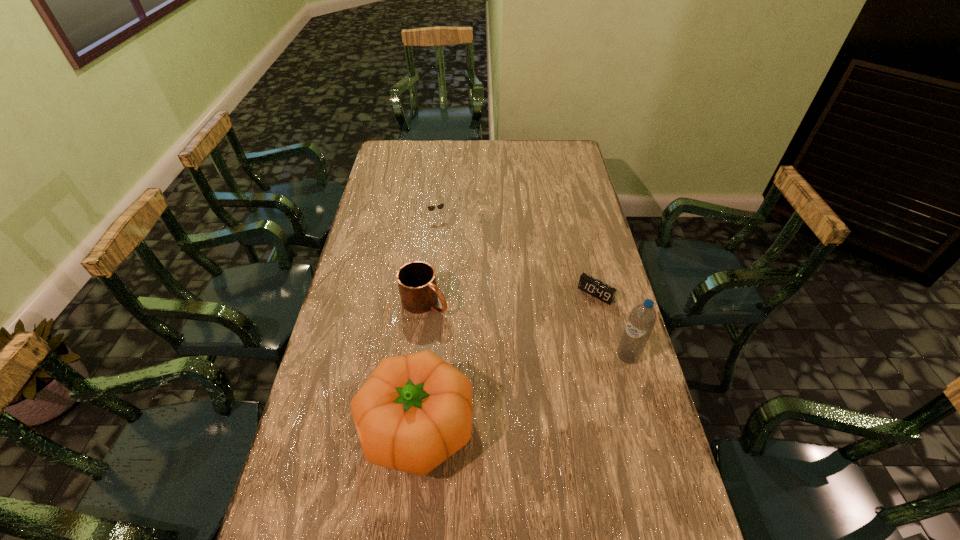
The image size is (960, 540). What are the coordinates of `the nearest object` in the screenshot? It's located at (414, 411).

Find the location of a particular element. This screenshot has height=540, width=960. the fourth farthest object is located at coordinates (642, 319).

Where is `alarm clock`? The height and width of the screenshot is (540, 960). alarm clock is located at coordinates (596, 288).

The height and width of the screenshot is (540, 960). What are the coordinates of `the third shortest object` in the screenshot? It's located at (419, 293).

Locate an element on the screen. The width and height of the screenshot is (960, 540). the fourth tallest object is located at coordinates (440, 206).

Where is `sunglasses`? sunglasses is located at coordinates (440, 206).

Where is `vacant area situated 0.110m on the carved face of the pumpkin`? The width and height of the screenshot is (960, 540). vacant area situated 0.110m on the carved face of the pumpkin is located at coordinates (316, 427).

Image resolution: width=960 pixels, height=540 pixels. Find the location of `free point located 0.100m on the carved face of the pumpkin`. free point located 0.100m on the carved face of the pumpkin is located at coordinates (320, 427).

This screenshot has height=540, width=960. I want to click on vacant space located on the carved face of the pumpkin, so click(307, 427).

You are a GUI agent. You are given a task and a screenshot of the screen. Output one action in this format:
    pyautogui.click(x=<x>, y=<y>)
    Task: Click on the vacant space situated 0.400m on the front of the second nearest object
    
    Given the screenshot: What is the action you would take?
    pyautogui.click(x=672, y=520)